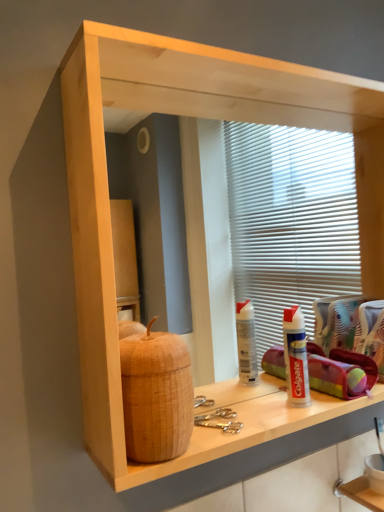
Question: In terms of width, does white plastic toothpaste tube at lower right look wider or thinner when compared to brown woven basket at left?

Choices:
 (A) wide
 (B) thin

Answer: (A)

Question: In the image, is white plastic toothpaste tube at lower right positioned in front of or behind brown woven basket at left?

Choices:
 (A) behind
 (B) front

Answer: (A)

Question: Which object is the farthest from the white plastic toothpaste tube at lower right?

Choices:
 (A) white wood shelf at lower right
 (B) brown woven basket at left

Answer: (B)

Question: Which object is positioned farthest from the white plastic toothpaste tube at lower right?

Choices:
 (A) white wood shelf at lower right
 (B) brown woven basket at left

Answer: (B)